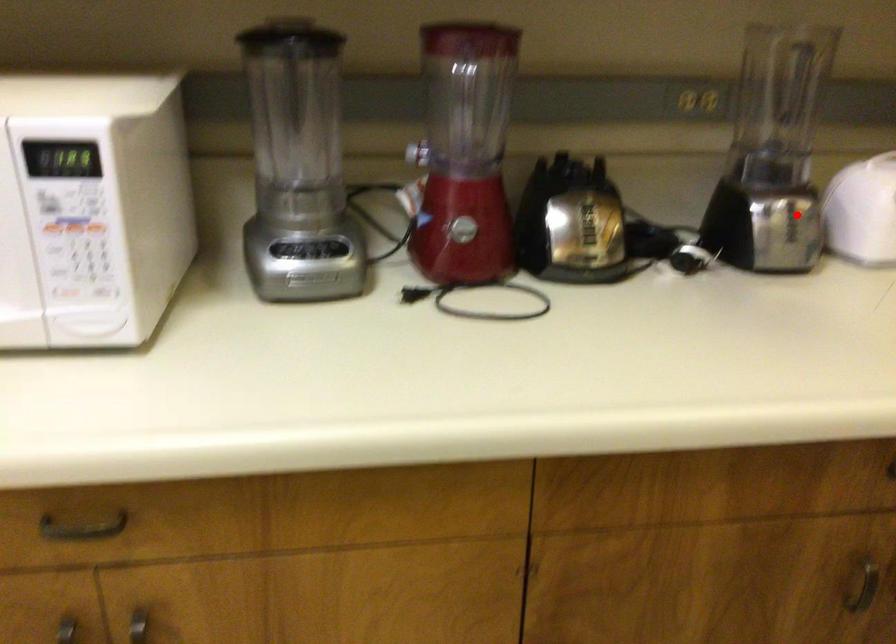
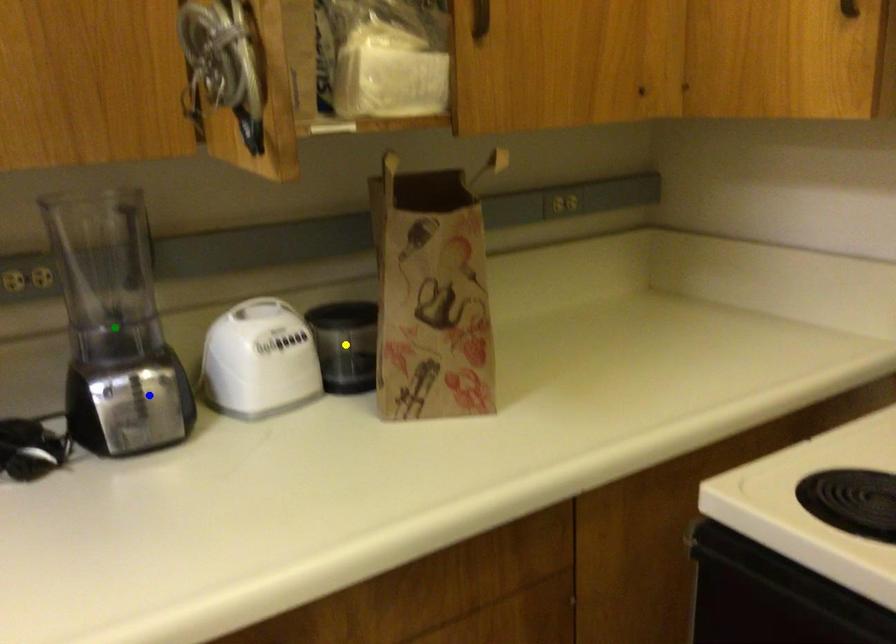
Question: I am providing you with two images of the same scene from different viewpoints. A red point is marked on the first image. You are given multiple points on the second image. Which spot in image 2 lines up with the point in image 1?

Choices:
 (A) yellow point
 (B) green point
 (C) blue point

Answer: (C)